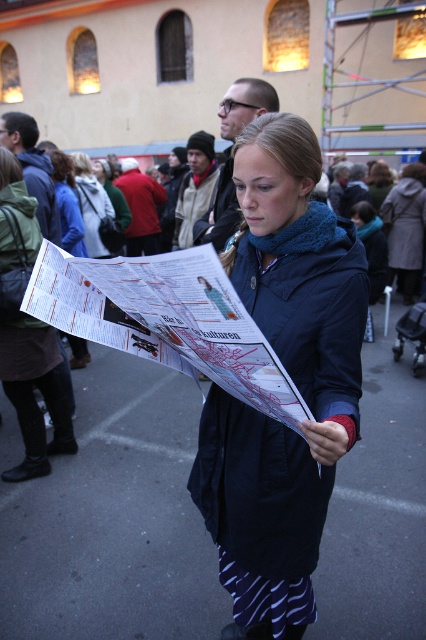
You are a photographer trying to capture a clear shot of the blue matte coat at center without the matte paper map at center blocking it. Based on their positions, is this possible?

The blue matte coat at center is positioned under the matte paper map at center, so the map is blocking the coat. Therefore, you cannot capture a clear shot of the blue matte coat at center without the matte paper map at center blocking it.